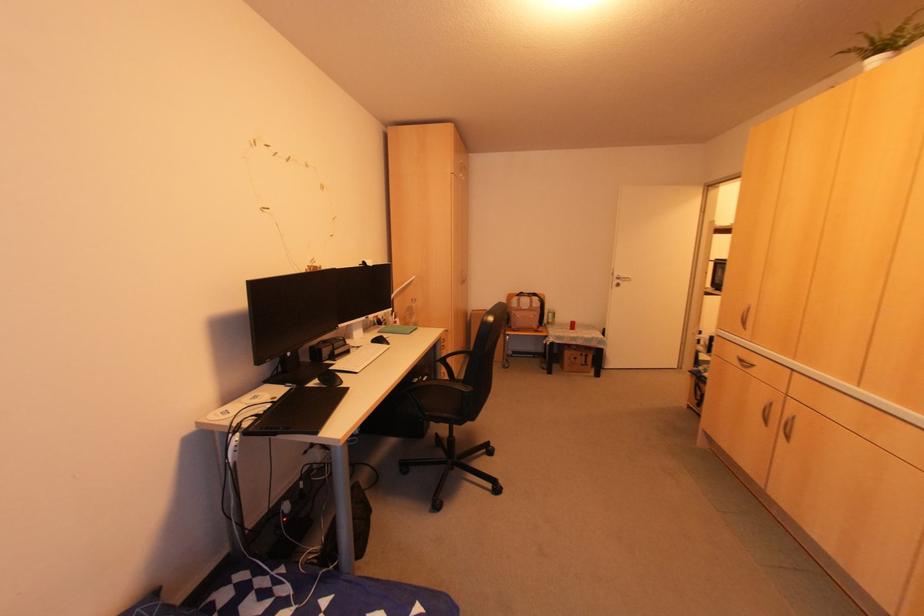
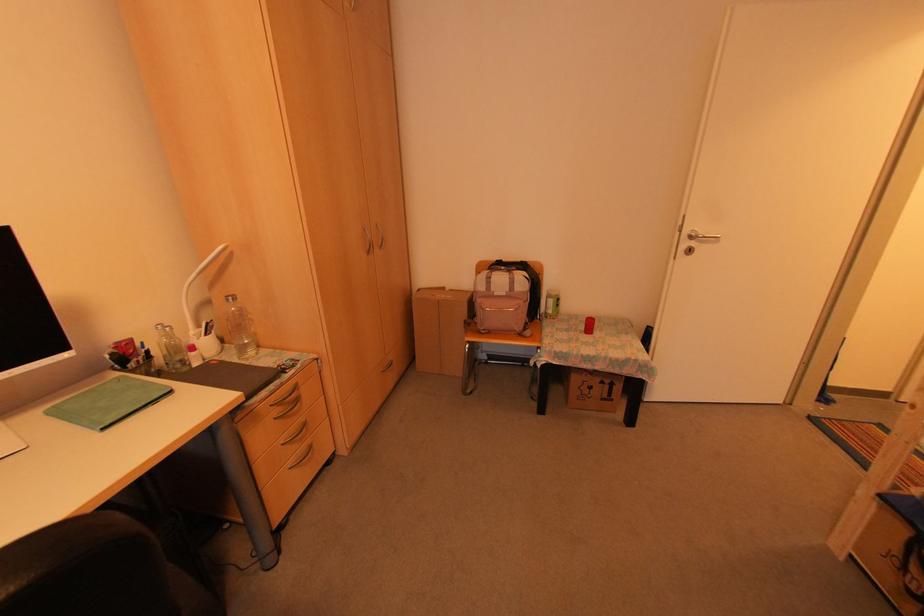
Where in the second image is the point corresponding to the point at 460,346 from the first image?

(388, 359)